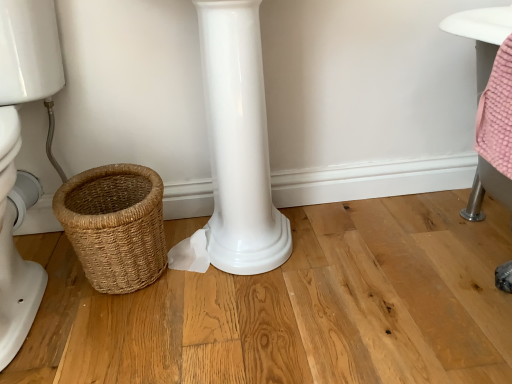
Describe the element at coordinates (17, 152) in the screenshot. I see `white glossy toilet at left` at that location.

The image size is (512, 384). What are the coordinates of `white glossy toilet at left` in the screenshot? It's located at click(x=17, y=152).

What is the approximate height of white glossy toilet at left?

white glossy toilet at left is 26.36 inches tall.

This screenshot has height=384, width=512. What do you see at coordinates (115, 225) in the screenshot?
I see `braided wicker basket at lower left` at bounding box center [115, 225].

What is the approximate width of braided wicker basket at lower left?

braided wicker basket at lower left is 11.19 inches in width.

Find the location of a particular element. braided wicker basket at lower left is located at coordinates (115, 225).

The image size is (512, 384). Find the location of `white glossy toilet at left`. white glossy toilet at left is located at coordinates (17, 152).

From the picture: Between white glossy toilet at left and braided wicker basket at lower left, which one appears on the left side from the viewer's perspective?

white glossy toilet at left.

Is white glossy toilet at left closer to camera compared to braided wicker basket at lower left?

Yes, it is in front of braided wicker basket at lower left.

Does point (16, 53) come in front of point (92, 201)?

Yes.

From the image's perspective, is white glossy toilet at left above braided wicker basket at lower left?

Indeed, from the image's perspective, white glossy toilet at left is shown above braided wicker basket at lower left.

From a real-world perspective, who is located higher, white glossy toilet at left or braided wicker basket at lower left?

white glossy toilet at left.

Is white glossy toilet at left thinner than braided wicker basket at lower left?

No.

Does white glossy toilet at left have a greater height compared to braided wicker basket at lower left?

Correct, white glossy toilet at left is much taller as braided wicker basket at lower left.

Which of these two, white glossy toilet at left or braided wicker basket at lower left, is bigger?

With larger size is white glossy toilet at left.

Is braided wicker basket at lower left surrounded by white glossy toilet at left?

No.

Is white glossy toilet at left far from braided wicker basket at lower left?

No, white glossy toilet at left is not far from braided wicker basket at lower left.

Is white glossy toilet at left looking in the opposite direction of braided wicker basket at lower left?

That's not correct — white glossy toilet at left is not looking away from braided wicker basket at lower left.

In the scene shown: How many degrees apart are the facing directions of white glossy toilet at left and braided wicker basket at lower left?

white glossy toilet at left and braided wicker basket at lower left are facing 3.5 degrees away from each other.

Locate an element on the screen. basket located underneath the white glossy toilet at left (from a real-world perspective) is located at coordinates (115, 225).

Considering the relative positions of braided wicker basket at lower left and white glossy toilet at left in the image provided, is braided wicker basket at lower left to the right of white glossy toilet at left from the viewer's perspective?

Indeed, braided wicker basket at lower left is positioned on the right side of white glossy toilet at left.

Is braided wicker basket at lower left positioned in front of white glossy toilet at left?

No, braided wicker basket at lower left is further to the viewer.

Which point is more distant from viewer, (131, 272) or (24, 6)?

The point (131, 272) is behind.

From the image's perspective, is braided wicker basket at lower left on top of white glossy toilet at left?

No, from the image's perspective, braided wicker basket at lower left is not on top of white glossy toilet at left.

From a real-world perspective, is braided wicker basket at lower left positioned above or below white glossy toilet at left?

Clearly, from a real-world perspective, braided wicker basket at lower left is below white glossy toilet at left.

Between braided wicker basket at lower left and white glossy toilet at left, which one has smaller width?

With smaller width is braided wicker basket at lower left.

Considering the relative sizes of braided wicker basket at lower left and white glossy toilet at left in the image provided, is braided wicker basket at lower left taller than white glossy toilet at left?

No, braided wicker basket at lower left is not taller than white glossy toilet at left.

Is braided wicker basket at lower left bigger or smaller than white glossy toilet at left?

Considering their sizes, braided wicker basket at lower left takes up less space than white glossy toilet at left.

Is braided wicker basket at lower left completely or partially outside of white glossy toilet at left?

Yes, braided wicker basket at lower left is not within white glossy toilet at left.

Is there a large distance between braided wicker basket at lower left and white glossy toilet at left?

No, braided wicker basket at lower left is in close proximity to white glossy toilet at left.

Is braided wicker basket at lower left aimed at white glossy toilet at left?

No, braided wicker basket at lower left is not aimed at white glossy toilet at left.

How many degrees apart are the facing directions of braided wicker basket at lower left and white glossy toilet at left?

There is a 3.5-degree angle between the facing directions of braided wicker basket at lower left and white glossy toilet at left.

Where is `toilet located on the left of braided wicker basket at lower left`? toilet located on the left of braided wicker basket at lower left is located at coordinates (17, 152).

In order to click on basket behind the white glossy toilet at left in this screenshot , I will do `click(115, 225)`.

What are the coordinates of `basket that is under the white glossy toilet at left (from a real-world perspective)` in the screenshot? It's located at click(115, 225).